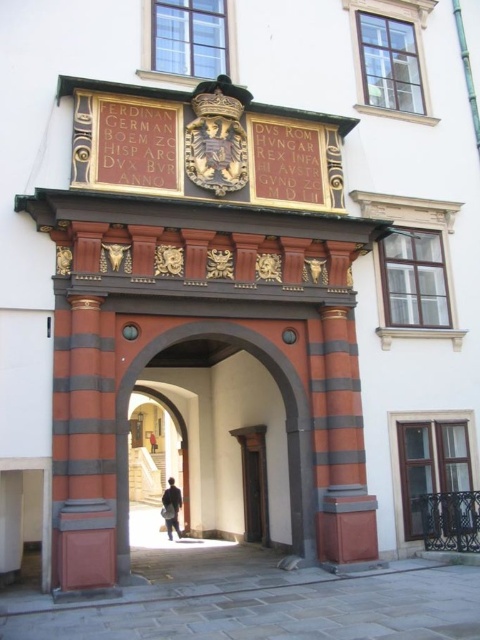
Question: Which of the following is the closest to the observer?

Choices:
 (A) matte wood door at center
 (B) smooth wood door at center
 (C) dark blue jacket at center

Answer: (B)

Question: Does matte wood door at center come in front of dark brown leather jacket at center?

Choices:
 (A) no
 (B) yes

Answer: (B)

Question: Which object is the closest to the matte wood door at center?

Choices:
 (A) dark blue jacket at center
 (B) dark brown leather jacket at center

Answer: (B)

Question: Can you confirm if smooth wood door at center is thinner than dark brown leather jacket at center?

Choices:
 (A) no
 (B) yes

Answer: (A)

Question: Among these points, which one is farthest from the camera?

Choices:
 (A) (171, 499)
 (B) (154, 444)
 (C) (257, 458)
 (D) (118, 404)

Answer: (B)

Question: Can you confirm if matte wood door at center is smaller than dark brown leather jacket at center?

Choices:
 (A) no
 (B) yes

Answer: (B)